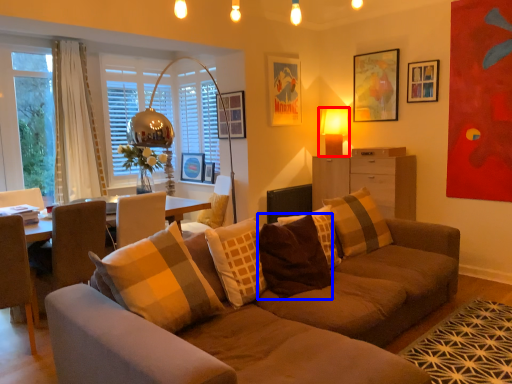
Question: Which of the following is the farthest to the observer, table lamp (highlighted by a red box) or pillow (highlighted by a blue box)?

Choices:
 (A) table lamp
 (B) pillow

Answer: (A)